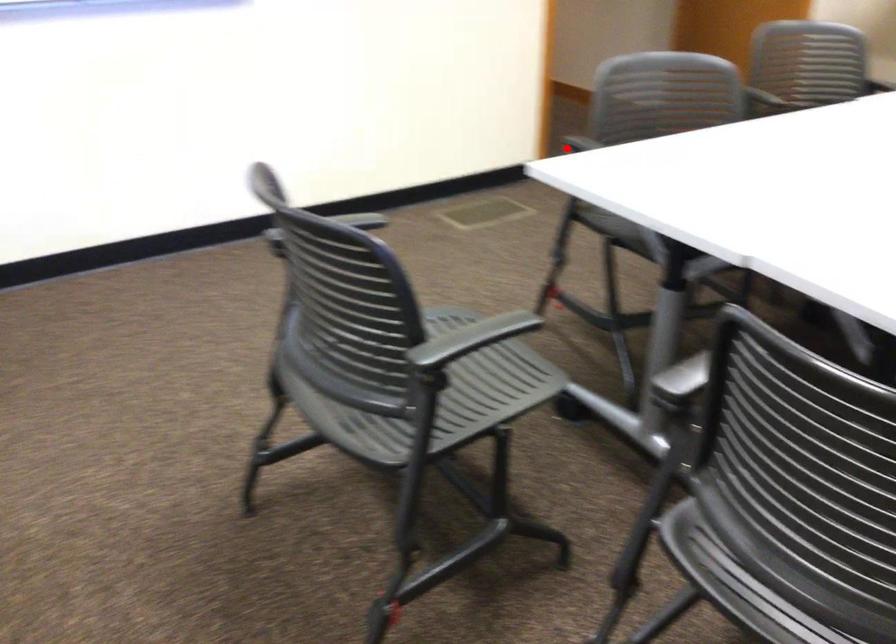
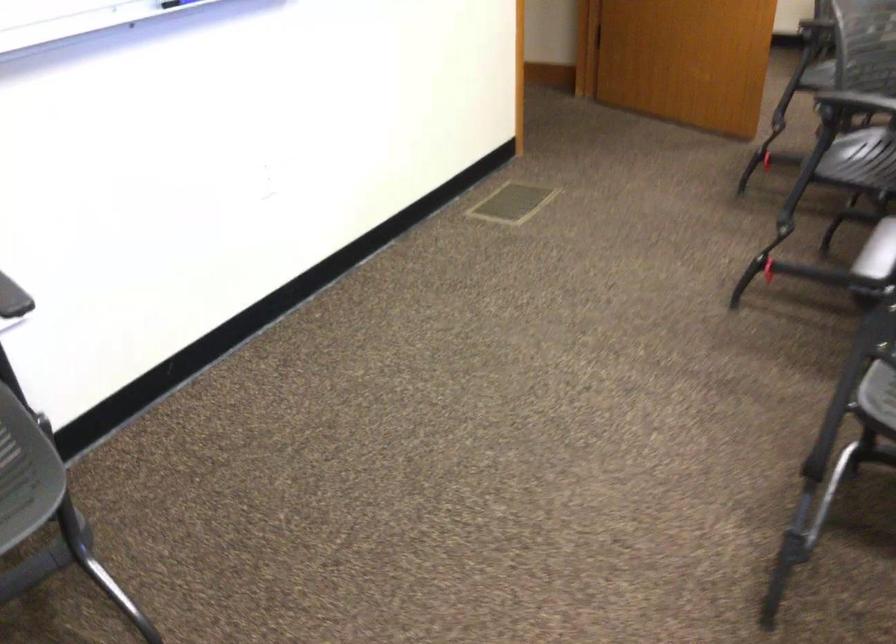
Where in the second image is the point corresponding to the highlighted location from the first image?

(857, 102)